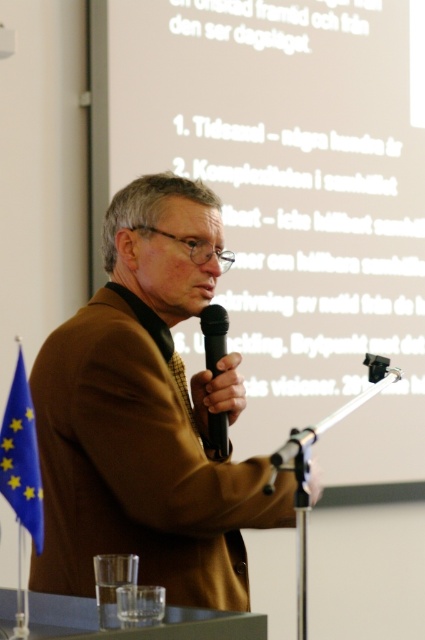
You are an event organizer who needs to ensure that the microphone is visible to the audience. Given the setup, will the black matte microphone at center be obscured by the white matte projection screen at upper center?

The white matte projection screen at upper center is larger in size than the black matte microphone at center, so the microphone could be partially obscured by the screen from certain angles.

You are an event organizer and need to adjust the podium setup. The brown leather jacket at center is currently blocking the black matte microphone at center. Which object should you move to resolve this issue?

The brown leather jacket at center is positioned under the black matte microphone at center. To resolve the blockage, move the brown leather jacket at center away from underneath the microphone.